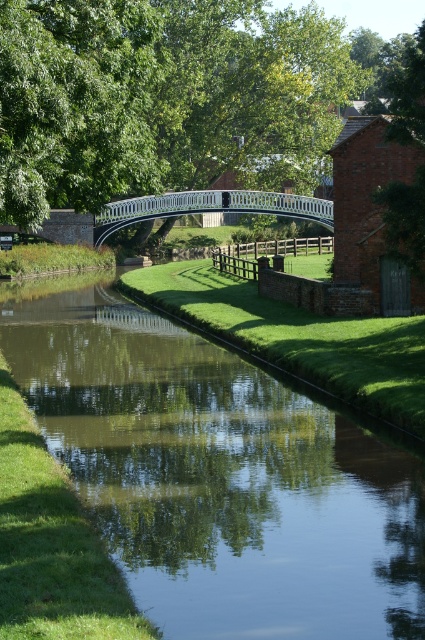
Does green grassy bank at center have a larger size compared to white glossy bridge at center?

Actually, green grassy bank at center might be smaller than white glossy bridge at center.

Measure the distance between point (x=365, y=620) and camera.

Point (x=365, y=620) is 9.12 meters away from camera.

Locate an element on the screen. green grassy bank at center is located at coordinates (221, 476).